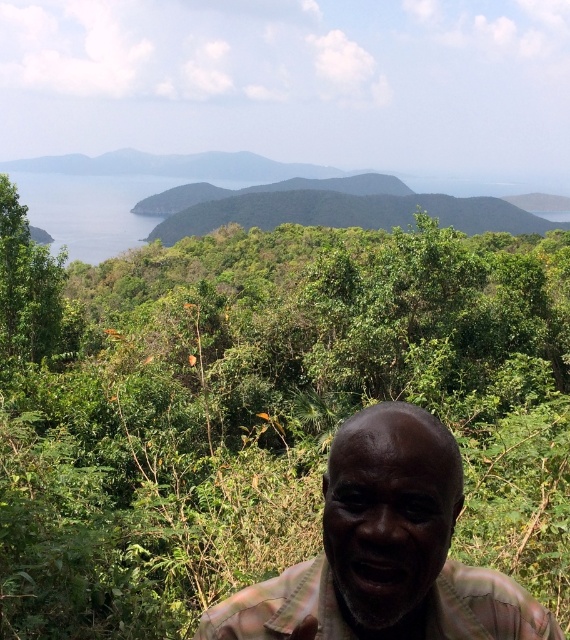
Who is taller, green leafy jungle at center or plaid fabric face at center?

green leafy jungle at center is taller.

Can you confirm if green leafy jungle at center is smaller than plaid fabric face at center?

Actually, green leafy jungle at center might be larger than plaid fabric face at center.

At what (x,y) coordinates should I click in order to perform the action: click on green leafy jungle at center. Please return your answer as a coordinate pair (x, y). Looking at the image, I should click on (262, 408).